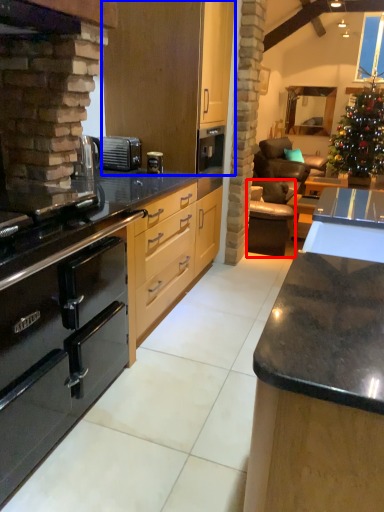
Question: Among these objects, which one is nearest to the camera, armchair (highlighted by a red box) or cabinetry (highlighted by a blue box)?

Choices:
 (A) armchair
 (B) cabinetry

Answer: (B)